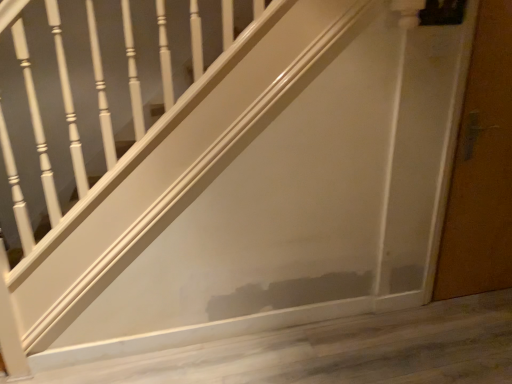
Image resolution: width=512 pixels, height=384 pixels. What are the coordinates of `brown matte door at right` in the screenshot? It's located at (481, 167).

What do you see at coordinates (481, 167) in the screenshot? I see `brown matte door at right` at bounding box center [481, 167].

I want to click on brown matte door at right, so click(x=481, y=167).